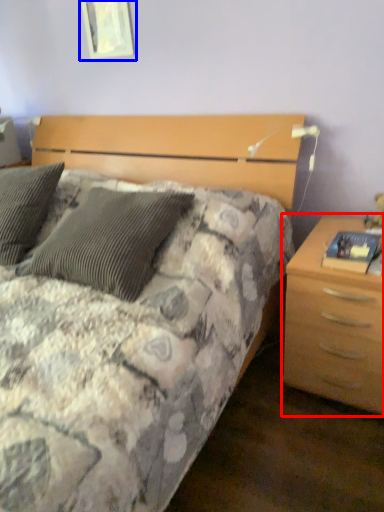
Question: Which of the following is the farthest to the observer, nightstand (highlighted by a red box) or picture frame (highlighted by a blue box)?

Choices:
 (A) nightstand
 (B) picture frame

Answer: (B)